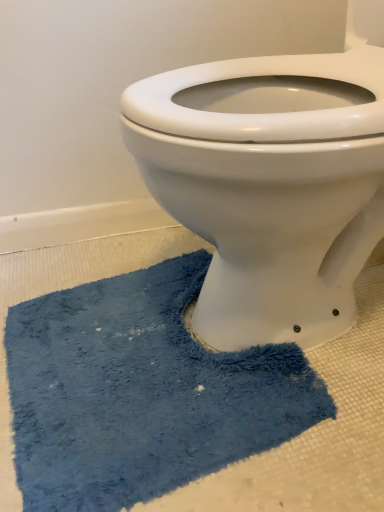
Find the location of a particular element. The width and height of the screenshot is (384, 512). blue fuzzy bath mat at lower center is located at coordinates (141, 392).

What do you see at coordinates (141, 392) in the screenshot? I see `blue fuzzy bath mat at lower center` at bounding box center [141, 392].

Find the location of a particular element. The image size is (384, 512). white glossy porcelain toilet at center is located at coordinates (269, 185).

This screenshot has width=384, height=512. Describe the element at coordinates (269, 185) in the screenshot. I see `white glossy porcelain toilet at center` at that location.

Locate an element on the screen. The height and width of the screenshot is (512, 384). blue fuzzy bath mat at lower center is located at coordinates (141, 392).

Considering the positions of objects blue fuzzy bath mat at lower center and white glossy porcelain toilet at center in the image provided, who is more to the left, blue fuzzy bath mat at lower center or white glossy porcelain toilet at center?

From the viewer's perspective, blue fuzzy bath mat at lower center appears more on the left side.

In the image, is blue fuzzy bath mat at lower center positioned in front of or behind white glossy porcelain toilet at center?

In the image, blue fuzzy bath mat at lower center appears behind white glossy porcelain toilet at center.

Which is in front, point (161, 324) or point (236, 224)?

Positioned in front is point (236, 224).

From the image's perspective, is blue fuzzy bath mat at lower center above or below white glossy porcelain toilet at center?

blue fuzzy bath mat at lower center is situated lower than white glossy porcelain toilet at center in the image.

From a real-world perspective, between blue fuzzy bath mat at lower center and white glossy porcelain toilet at center, who is vertically higher?

white glossy porcelain toilet at center is physically above.

Looking at their sizes, would you say blue fuzzy bath mat at lower center is wider or thinner than white glossy porcelain toilet at center?

Considering their sizes, blue fuzzy bath mat at lower center looks slimmer than white glossy porcelain toilet at center.

Considering the sizes of objects blue fuzzy bath mat at lower center and white glossy porcelain toilet at center in the image provided, who is taller, blue fuzzy bath mat at lower center or white glossy porcelain toilet at center?

white glossy porcelain toilet at center.

Considering the relative sizes of blue fuzzy bath mat at lower center and white glossy porcelain toilet at center in the image provided, is blue fuzzy bath mat at lower center smaller than white glossy porcelain toilet at center?

Indeed, blue fuzzy bath mat at lower center has a smaller size compared to white glossy porcelain toilet at center.

Is blue fuzzy bath mat at lower center inside or outside of white glossy porcelain toilet at center?

blue fuzzy bath mat at lower center exists outside the volume of white glossy porcelain toilet at center.

Is blue fuzzy bath mat at lower center far away from white glossy porcelain toilet at center?

blue fuzzy bath mat at lower center is near white glossy porcelain toilet at center, not far away.

Is blue fuzzy bath mat at lower center oriented away from white glossy porcelain toilet at center?

No, white glossy porcelain toilet at center is not at the back of blue fuzzy bath mat at lower center.

Can you tell me how much blue fuzzy bath mat at lower center and white glossy porcelain toilet at center differ in facing direction?

They differ by 6.98 degrees in their facing directions.

How distant is blue fuzzy bath mat at lower center from white glossy porcelain toilet at center?

They are 9.00 inches apart.

Image resolution: width=384 pixels, height=512 pixels. Identify the location of bath mat located on the left of white glossy porcelain toilet at center. (141, 392).

Is white glossy porcelain toilet at center to the left of blue fuzzy bath mat at lower center from the viewer's perspective?

Incorrect, white glossy porcelain toilet at center is not on the left side of blue fuzzy bath mat at lower center.

Considering the positions of objects white glossy porcelain toilet at center and blue fuzzy bath mat at lower center in the image provided, who is behind, white glossy porcelain toilet at center or blue fuzzy bath mat at lower center?

blue fuzzy bath mat at lower center is behind.

Which point is more distant from viewer, (278, 272) or (130, 401)?

Point (278, 272)

From the image's perspective, between white glossy porcelain toilet at center and blue fuzzy bath mat at lower center, who is located below?

blue fuzzy bath mat at lower center, from the image's perspective.

From a real-world perspective, which is physically below, white glossy porcelain toilet at center or blue fuzzy bath mat at lower center?

blue fuzzy bath mat at lower center is physically lower.

In terms of width, does white glossy porcelain toilet at center look wider or thinner when compared to blue fuzzy bath mat at lower center?

Clearly, white glossy porcelain toilet at center has more width compared to blue fuzzy bath mat at lower center.

In terms of height, does white glossy porcelain toilet at center look taller or shorter compared to blue fuzzy bath mat at lower center?

white glossy porcelain toilet at center is taller than blue fuzzy bath mat at lower center.

Based on the photo, who is smaller, white glossy porcelain toilet at center or blue fuzzy bath mat at lower center?

Smaller between the two is blue fuzzy bath mat at lower center.

Is white glossy porcelain toilet at center located outside blue fuzzy bath mat at lower center?

Indeed, white glossy porcelain toilet at center is completely outside blue fuzzy bath mat at lower center.

Are white glossy porcelain toilet at center and blue fuzzy bath mat at lower center located far from each other?

white glossy porcelain toilet at center is actually quite close to blue fuzzy bath mat at lower center.

Is white glossy porcelain toilet at center positioned with its back to blue fuzzy bath mat at lower center?

No, white glossy porcelain toilet at center is not facing the opposite direction of blue fuzzy bath mat at lower center.

How many degrees apart are the facing directions of white glossy porcelain toilet at center and blue fuzzy bath mat at lower center?

The facing directions of white glossy porcelain toilet at center and blue fuzzy bath mat at lower center are 6.98 degrees apart.

The image size is (384, 512). Find the location of `bath mat below the white glossy porcelain toilet at center (from the image's perspective)`. bath mat below the white glossy porcelain toilet at center (from the image's perspective) is located at coordinates point(141,392).

Identify the location of bath mat below the white glossy porcelain toilet at center (from the image's perspective). (141, 392).

Image resolution: width=384 pixels, height=512 pixels. I want to click on toilet in front of the blue fuzzy bath mat at lower center, so click(x=269, y=185).